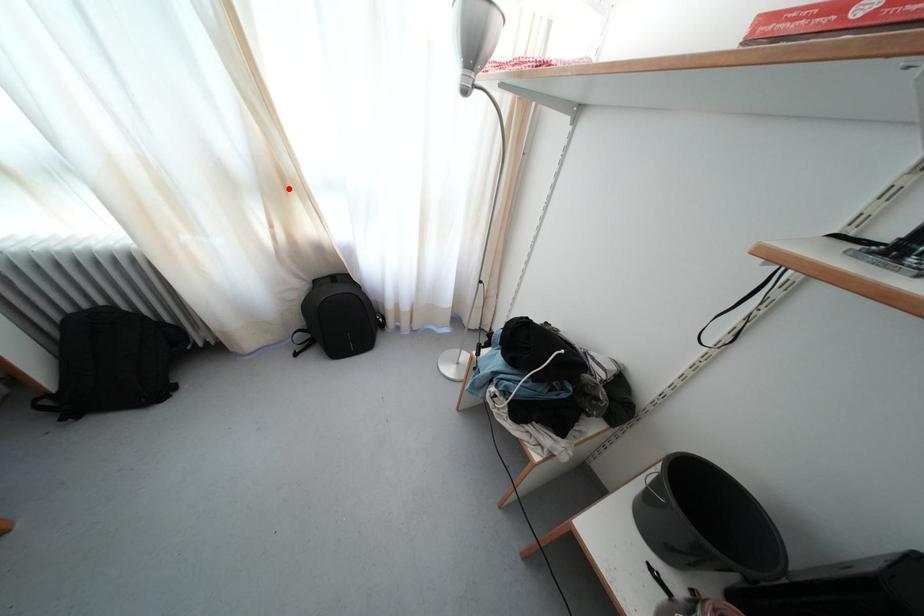
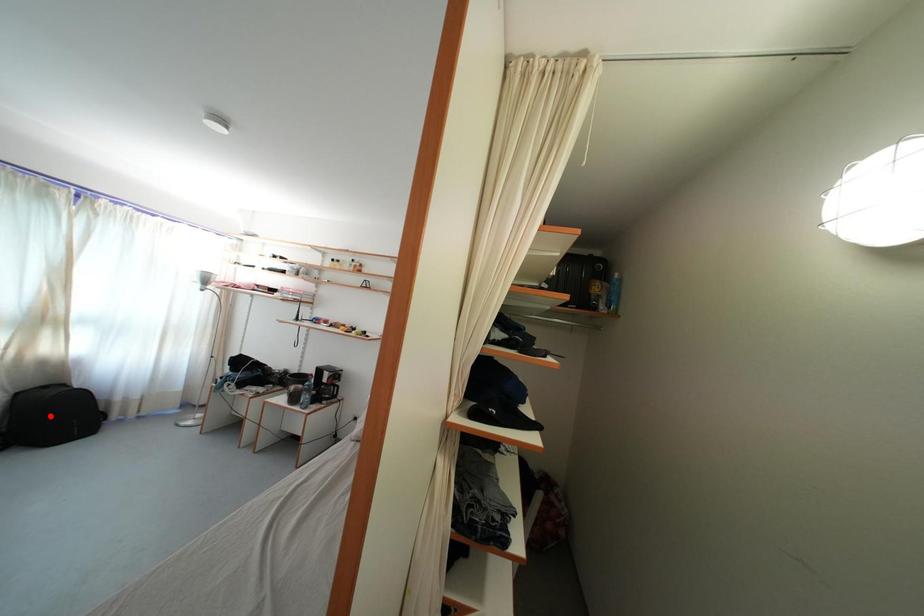
In the scene shown: I am providing you with two images of the same scene from different viewpoints. A red point is marked on the first image and another point is marked on the second image. Are the points marked in image1 and image2 representing the same 3D position?

No